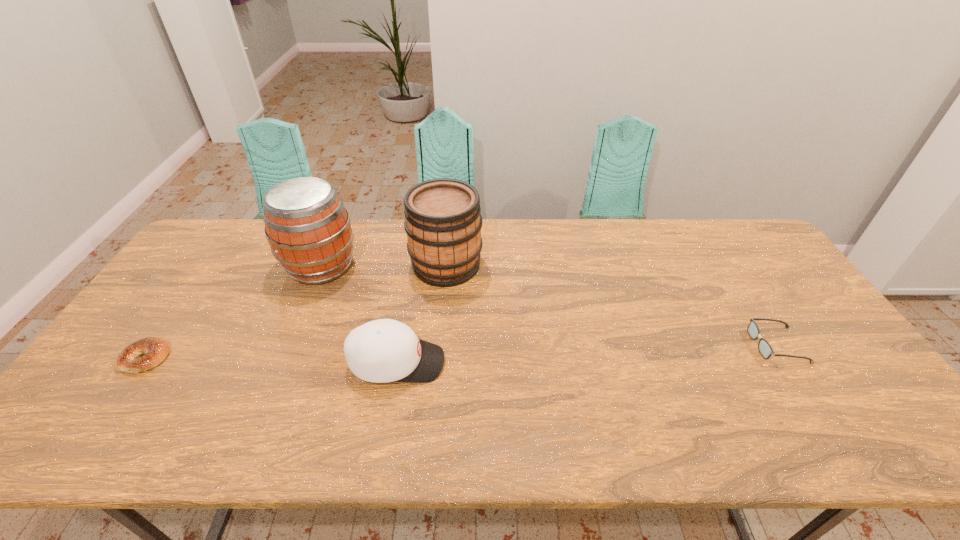
The width and height of the screenshot is (960, 540). I want to click on free spot located on the face of the rightmost object, so click(x=716, y=345).

I want to click on free point located on the face of the rightmost object, so click(644, 345).

The width and height of the screenshot is (960, 540). I want to click on blank space located 0.390m on the face of the rightmost object, so click(607, 345).

Locate an element on the screen. free space located on the front of the bagel is located at coordinates (104, 417).

This screenshot has width=960, height=540. I want to click on object located in the left edge section of the desktop, so click(154, 350).

The height and width of the screenshot is (540, 960). What are the coordinates of `object located at the right edge` in the screenshot? It's located at click(x=765, y=349).

Image resolution: width=960 pixels, height=540 pixels. I want to click on vacant region at the far edge of the desktop, so click(x=256, y=246).

Image resolution: width=960 pixels, height=540 pixels. Identify the location of vacant space at the near edge. (204, 424).

Where is `free region at the right edge of the desktop`? free region at the right edge of the desktop is located at coordinates (817, 325).

In the image, there is a desktop. Identify the location of free space at the far left corner. (230, 234).